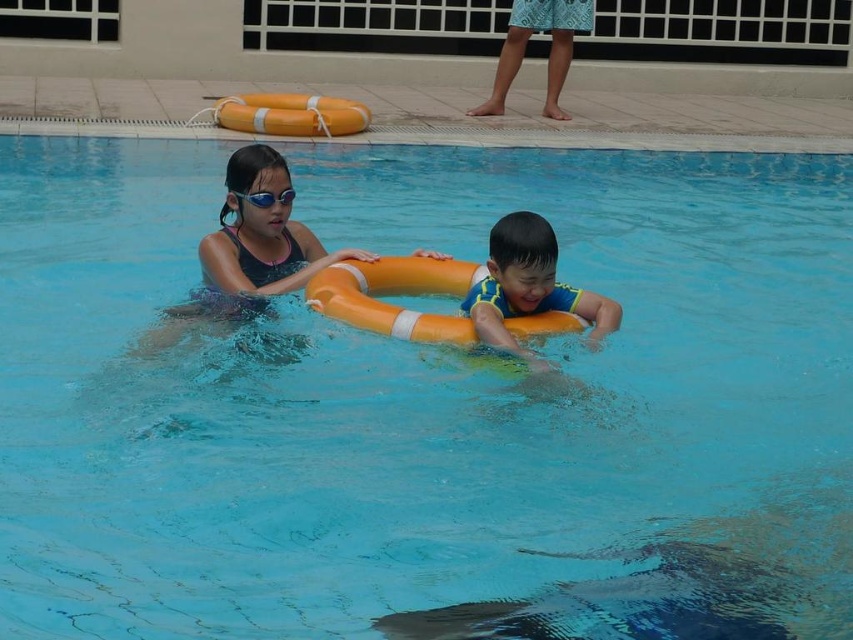
Question: Does yellow foam ring at center have a larger size compared to transparent plastic goggles at upper center?

Choices:
 (A) no
 (B) yes

Answer: (B)

Question: Which point appears closest to the camera in this image?

Choices:
 (A) (213, 234)
 (B) (473, 323)

Answer: (B)

Question: Based on their relative distances, which object is farther from the yellow foam ring at center?

Choices:
 (A) matte black swimsuit at center
 (B) transparent plastic goggles at upper center

Answer: (B)

Question: Does yellow foam ring at center have a smaller size compared to transparent plastic goggles at upper center?

Choices:
 (A) no
 (B) yes

Answer: (A)

Question: Where is yellow foam ring at center located in relation to transparent plastic goggles at upper center in the image?

Choices:
 (A) above
 (B) below

Answer: (B)

Question: Which object is closer to the camera taking this photo?

Choices:
 (A) transparent plastic goggles at upper center
 (B) matte black swimsuit at center

Answer: (B)